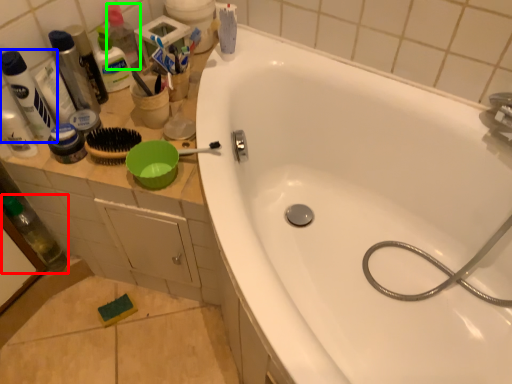
Question: Based on their relative distances, which object is nearer to bottle (highlighted by a red box)? Choose from toiletry (highlighted by a blue box) and bottle (highlighted by a green box).

Choices:
 (A) toiletry
 (B) bottle

Answer: (A)